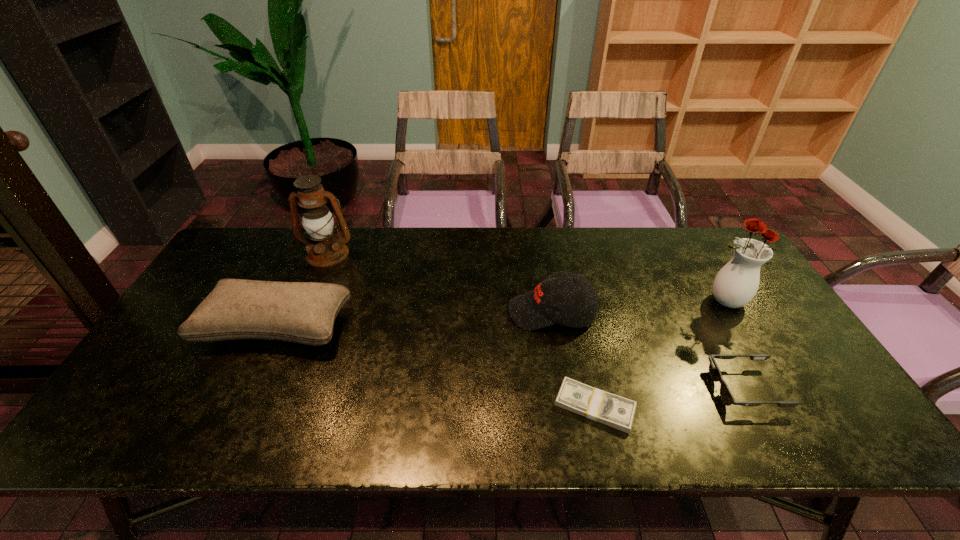
The image size is (960, 540). Find the location of `vase at the right edge`. vase at the right edge is located at coordinates (736, 284).

At what (x,y) coordinates should I click in order to perform the action: click on sunglasses that is at the right edge. Please return your answer as a coordinate pair (x, y). This screenshot has height=540, width=960. Looking at the image, I should click on (725, 393).

The height and width of the screenshot is (540, 960). I want to click on object present at the near right corner, so click(725, 393).

Image resolution: width=960 pixels, height=540 pixels. In the image, there is a desktop. In order to click on vacant space at the far edge in this screenshot , I will do `click(683, 247)`.

You are a GUI agent. You are given a task and a screenshot of the screen. Output one action in this format:
    pyautogui.click(x=<x>, y=<y>)
    Task: Click on the blank space at the near edge of the desktop
    The width and height of the screenshot is (960, 540).
    Given the screenshot: What is the action you would take?
    pyautogui.click(x=405, y=442)

In the image, there is a desktop. At what (x,y) coordinates should I click in order to perform the action: click on vacant space at the right edge. Please return your answer as a coordinate pair (x, y). Looking at the image, I should click on (777, 407).

In the image, there is a desktop. At what (x,y) coordinates should I click in order to perform the action: click on vacant area at the far right corner. Please return your answer as a coordinate pair (x, y). This screenshot has width=960, height=540. Looking at the image, I should click on (684, 235).

Locate an element on the screen. This screenshot has height=540, width=960. free spot between the fifth tallest object and the vase is located at coordinates (734, 345).

This screenshot has height=540, width=960. Find the location of `free space between the fifth tallest object and the vase`. free space between the fifth tallest object and the vase is located at coordinates (734, 345).

You are a GUI agent. You are given a task and a screenshot of the screen. Output one action in this format:
    pyautogui.click(x=<x>, y=<y>)
    Task: Click on the vacant space that's between the vase and the baseball cap
    Image resolution: width=960 pixels, height=540 pixels.
    Given the screenshot: What is the action you would take?
    pyautogui.click(x=637, y=307)